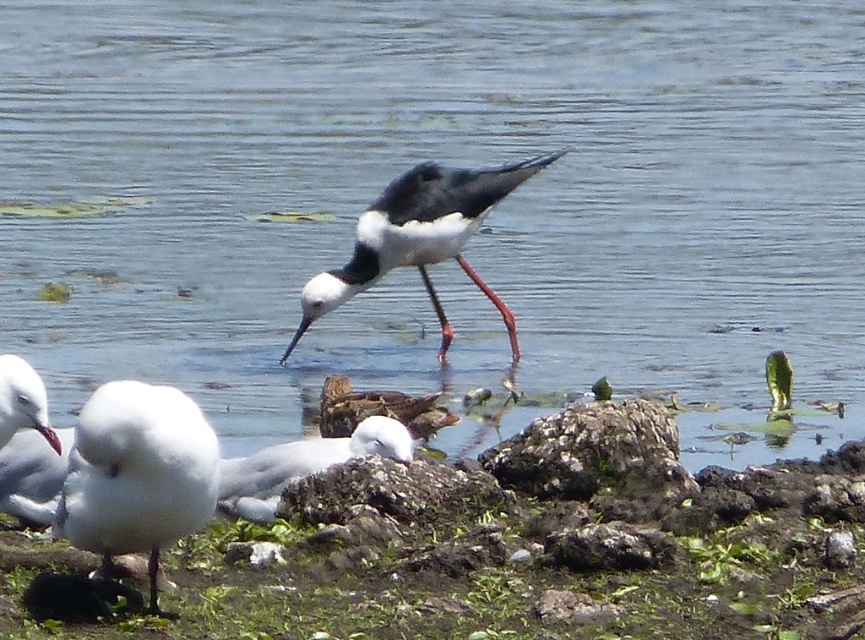
Question: Which point is farther to the camera?

Choices:
 (A) (561, 413)
 (B) (49, 428)
 (C) (24, 486)
 (D) (357, 448)

Answer: (A)

Question: Which of the following is the closest to the observer?

Choices:
 (A) white glossy bird at center
 (B) rusty rock at lower center
 (C) white fluffy feather at lower left

Answer: (C)

Question: Does white matte seagull at lower left have a larger size compared to white matte beak at lower left?

Choices:
 (A) yes
 (B) no

Answer: (A)

Question: Can you confirm if white fluffy feather at lower left is bigger than rusty rock at center?

Choices:
 (A) no
 (B) yes

Answer: (B)

Question: Which point is farther from the camera taking this photo?

Choices:
 (A) (386, 506)
 (B) (360, 268)
 (C) (489, 458)
 (D) (43, 426)

Answer: (B)

Question: Observing the image, what is the correct spatial positioning of white matte seagull at lower left in reference to white matte beak at lower left?

Choices:
 (A) left
 (B) right

Answer: (A)